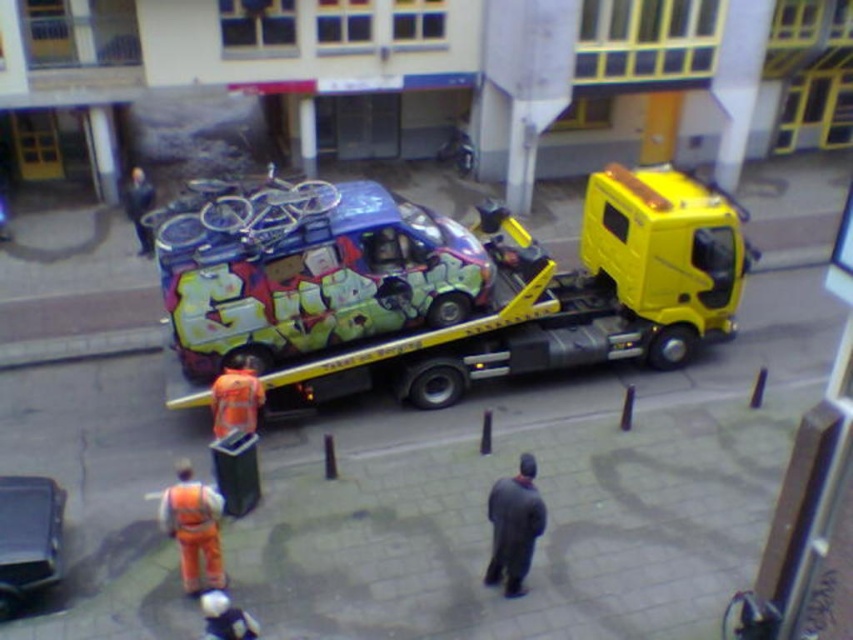
In the scene shown: Is yellow metallic tow truck at center to the right of dark gray wool coat at center from the viewer's perspective?

Correct, you'll find yellow metallic tow truck at center to the right of dark gray wool coat at center.

Is point (711, 317) less distant than point (531, 540)?

That is False.

Find the location of a particular element. yellow metallic tow truck at center is located at coordinates (547, 300).

Can you confirm if yellow metallic tow truck at center is smaller than metallic blue car at lower left?

No.

Is point (624, 269) positioned after point (9, 529)?

Yes, point (624, 269) is farther from viewer.

Where is `yellow metallic tow truck at center`? yellow metallic tow truck at center is located at coordinates (547, 300).

Which is more to the right, graffiti-covered car at center or reflective orange vest at lower left?

Positioned to the right is graffiti-covered car at center.

Does graffiti-covered car at center have a greater width compared to reflective orange vest at lower left?

Indeed, graffiti-covered car at center has a greater width compared to reflective orange vest at lower left.

This screenshot has height=640, width=853. What do you see at coordinates (311, 273) in the screenshot? I see `graffiti-covered car at center` at bounding box center [311, 273].

The height and width of the screenshot is (640, 853). Find the location of `graffiti-covered car at center`. graffiti-covered car at center is located at coordinates (311, 273).